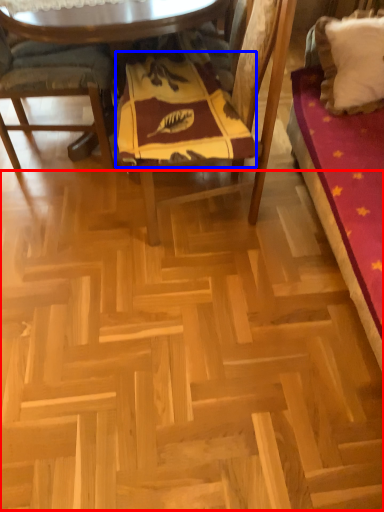
Question: Among these objects, which one is nearest to the camera, plywood (highlighted by a red box) or blanket (highlighted by a blue box)?

Choices:
 (A) plywood
 (B) blanket

Answer: (A)